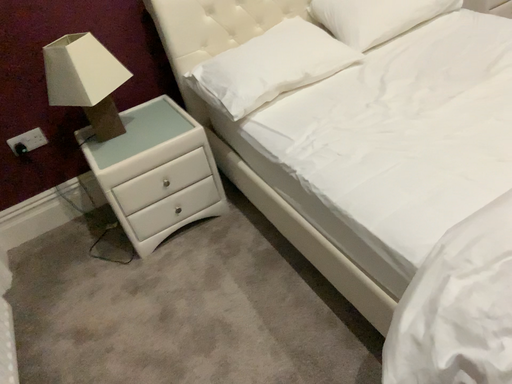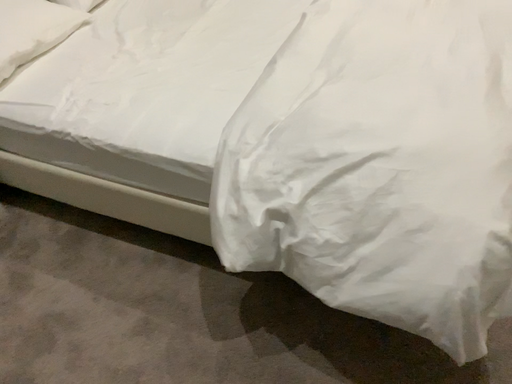
Question: How did the camera likely rotate when shooting the video?

Choices:
 (A) rotated right
 (B) rotated left

Answer: (A)